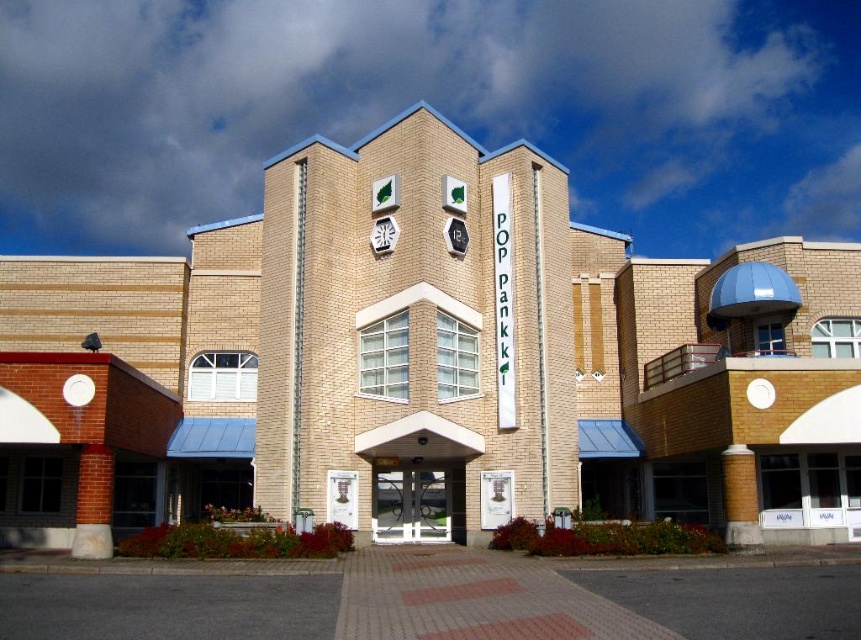
Question: Can you confirm if metallic hexagonal clock at center is positioned to the left of metallic hexagon at center?

Choices:
 (A) yes
 (B) no

Answer: (A)

Question: Is metallic hexagonal clock at center bigger than metallic hexagon at center?

Choices:
 (A) yes
 (B) no

Answer: (B)

Question: Which point appears closest to the camera in this image?

Choices:
 (A) (370, 236)
 (B) (463, 250)

Answer: (B)

Question: Is metallic hexagonal clock at center closer to the viewer compared to metallic hexagon at center?

Choices:
 (A) yes
 (B) no

Answer: (A)